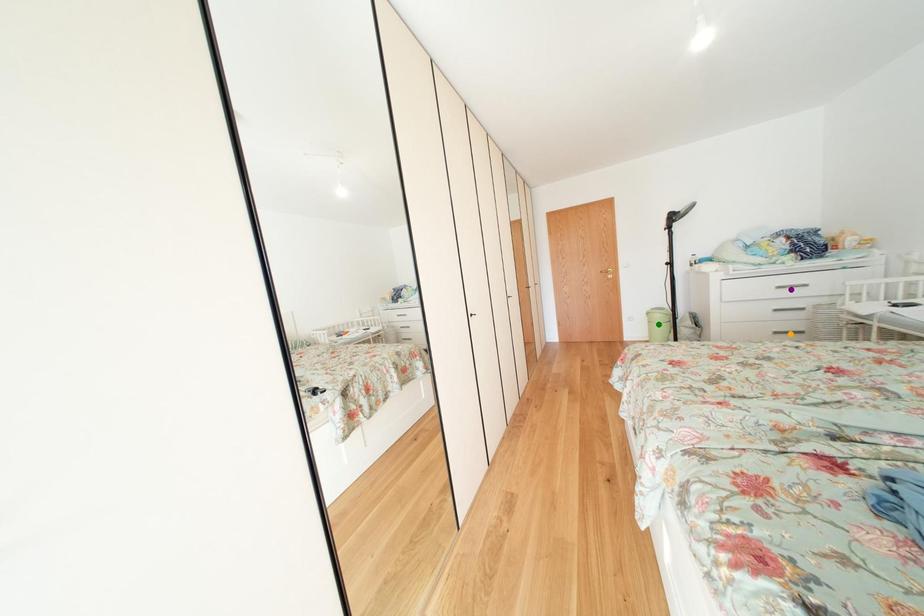
Order these from nearest to farthest:
1. purple point
2. green point
3. orange point

1. purple point
2. orange point
3. green point